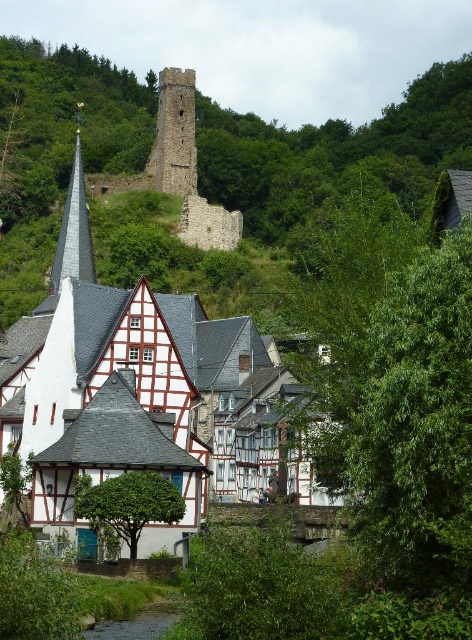
Question: Does white half-timbered houses at center come in front of brown stone tower at upper center?

Choices:
 (A) yes
 (B) no

Answer: (A)

Question: Does white half-timbered houses at center come in front of brown stone tower at upper center?

Choices:
 (A) no
 (B) yes

Answer: (B)

Question: Which point appears closest to the camera in this image?

Choices:
 (A) (70, 461)
 (B) (173, 113)

Answer: (A)

Question: Does white half-timbered houses at center have a smaller size compared to brown stone tower at upper center?

Choices:
 (A) yes
 (B) no

Answer: (B)

Question: Which point is farther from the camera taking this photo?

Choices:
 (A) (47, 412)
 (B) (177, 179)

Answer: (B)